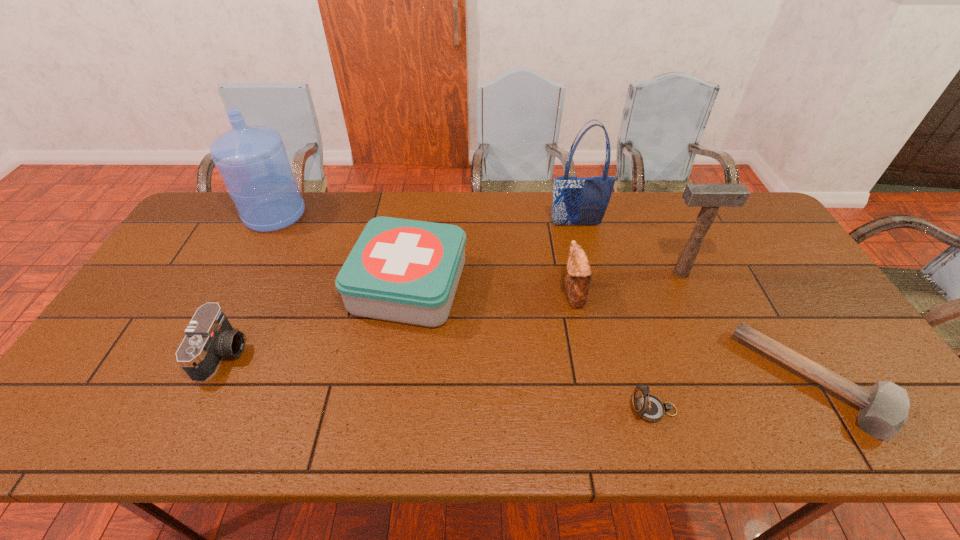
You are a GUI agent. You are given a task and a screenshot of the screen. Output one action in this format:
    pyautogui.click(x=<x>, y=<y>)
    Task: Click on the free space between the nearer mallet and the shopping bag
    This screenshot has width=960, height=540.
    Given the screenshot: What is the action you would take?
    [695, 303]

Where is `free space between the compass and the taller mallet`? The image size is (960, 540). free space between the compass and the taller mallet is located at coordinates (667, 341).

Locate an element on the screen. This screenshot has width=960, height=540. free space between the shopping bag and the shortest object is located at coordinates (695, 303).

Find the location of a particular element. The width and height of the screenshot is (960, 540). unoccupied area between the compass and the camera is located at coordinates point(439,381).

Identify which object is the fifth closest to the nearer mallet. Please provide its 2D coordinates. Your answer should be formatted as a tuple, i.e. [(x, y)], where the tuple contains the x and y coordinates of a point satisfying the conditions above.

[(401, 270)]

I want to click on the second closest object to the water jug, so click(x=209, y=337).

The width and height of the screenshot is (960, 540). I want to click on free space in the image that satisfies the following two spatial constraints: 1. on the front side of the shorter mallet; 2. on the left side of the taller mallet, so click(729, 381).

The width and height of the screenshot is (960, 540). In order to click on blank area in the image that satisfies the following two spatial constraints: 1. on the front-facing side of the camera; 2. on the right side of the nearer mallet in this screenshot , I will do `click(210, 381)`.

This screenshot has height=540, width=960. In order to click on vacant region that satisfies the following two spatial constraints: 1. on the front-facing side of the camera; 2. on the right side of the shortest object in this screenshot , I will do `click(210, 381)`.

Find the location of a particular element. This screenshot has height=540, width=960. vacant space that satisfies the following two spatial constraints: 1. on the front-facing side of the shopping bag; 2. on the front-facing side of the camera is located at coordinates (607, 353).